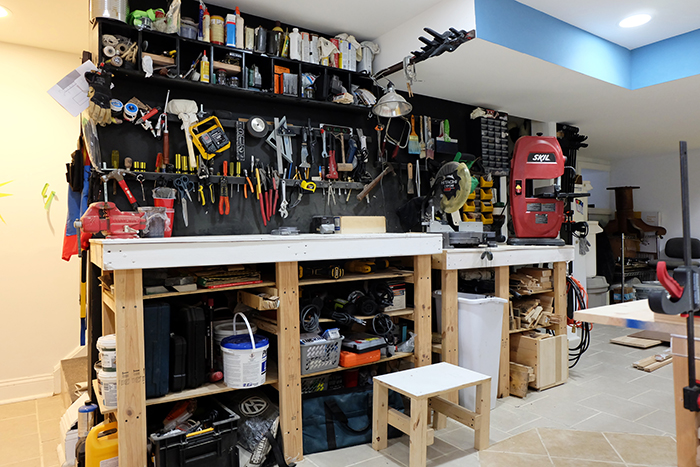
Find the location of a particular element. This screenshot has height=467, width=700. trash is located at coordinates (486, 355).